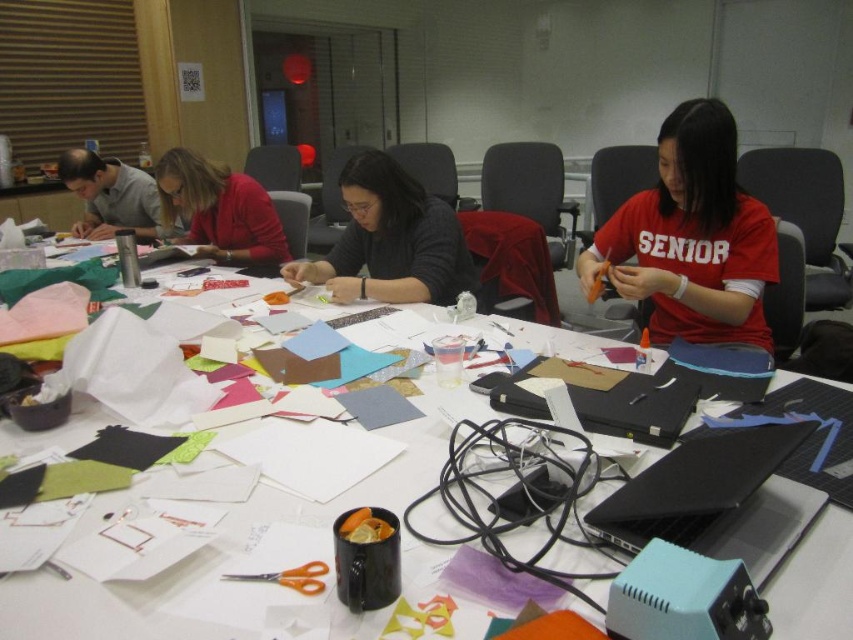
You are an observer looking at the crafting table. You see the white paper at center and the matte red sweater at upper left. Which object is positioned to the right of the other?

The white paper at center is to the right of the matte red sweater at upper left.

You are an observer looking at the crafting table scene. You notice two people wearing specific clothing items. The first is a person wearing a matte black sweater at center, and the second is someone in a matte gray shirt at upper left. Based on their positions in the image, which clothing item is positioned lower on the table?

The matte black sweater at center is positioned lower on the table compared to the matte gray shirt at upper left.

You are standing at the entrance of the conference room and see the table with the matte black sweater at center and the matte red sweater at upper left. From your perspective, which sweater is positioned to the right of the other?

The matte black sweater at center is to the right of the matte red sweater at upper left.